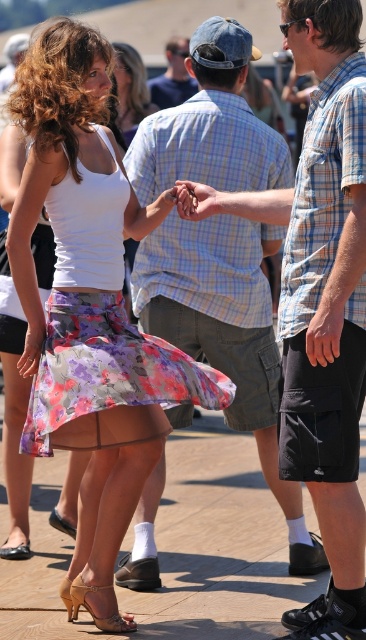
You are planning to take a photo of the light blue plaid shirt at center and the floral cotton skirt at center. If you want to ensure both are fully visible in the frame, which object should you focus on to avoid cropping the edges?

The light blue plaid shirt at center has a larger width than the floral cotton skirt at center, so you should focus on the light blue plaid shirt at center to avoid cropping its edges.

You are a photographer at the event and want to capture a photo of the blonde hair at center and denim cap at center. Since you can only focus on one object, which one should you choose to ensure both are in the frame?

The blonde hair at center is to the left of denim cap at center, so focusing on either object would keep both in the frame as they are positioned next to each other.

You are a photographer at this event and want to capture a clear shot of both the blonde hair at center and the denim cap at center. Since you know the height difference between them, which object should you focus on first to ensure both are in frame?

The blonde hair at center is taller than the denim cap at center, so you should focus on the blonde hair at center first to ensure the denim cap at center is also in frame.